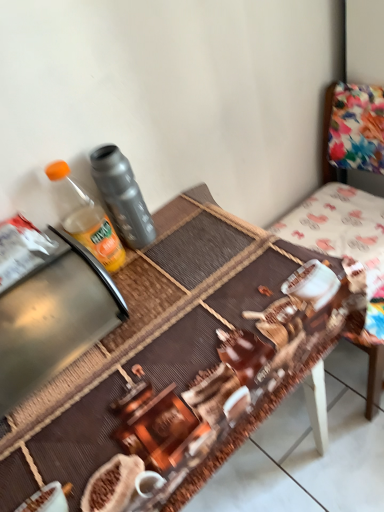
Find the location of a particular element. vacant space in front of translucent plastic bottle at upper left, arranged as the second bottle when viewed from the right is located at coordinates (145, 304).